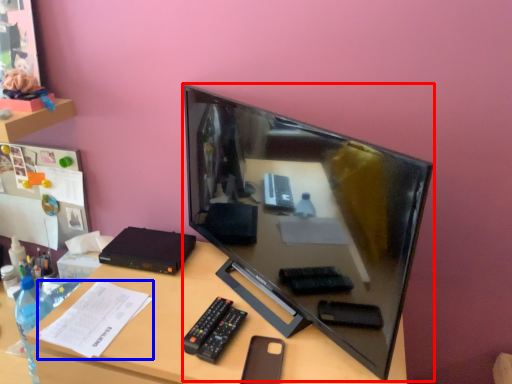
Question: Which object appears farthest to the camera in this image, television (highlighted by a red box) or paper (highlighted by a blue box)?

Choices:
 (A) television
 (B) paper

Answer: (B)